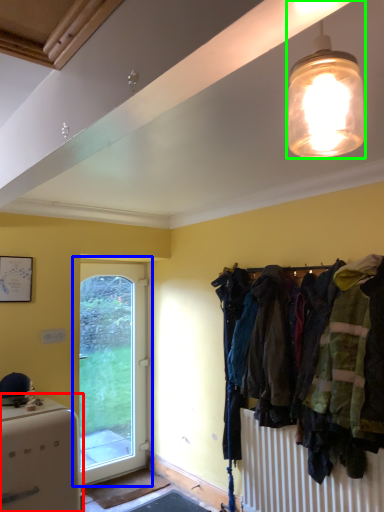
Question: Which is nearer to the appliance (highlighted by a red box)? door (highlighted by a blue box) or lamp (highlighted by a green box).

Choices:
 (A) door
 (B) lamp

Answer: (A)